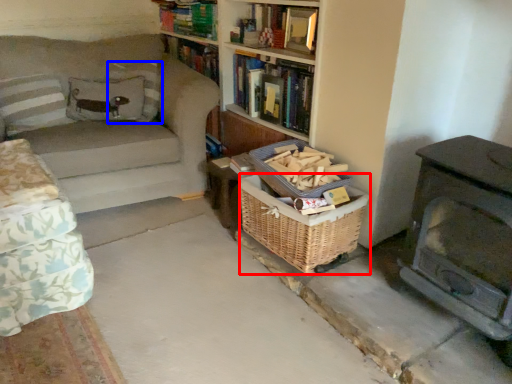
Question: Among these objects, which one is farthest to the camera, basket (highlighted by a red box) or pillow (highlighted by a blue box)?

Choices:
 (A) basket
 (B) pillow

Answer: (B)